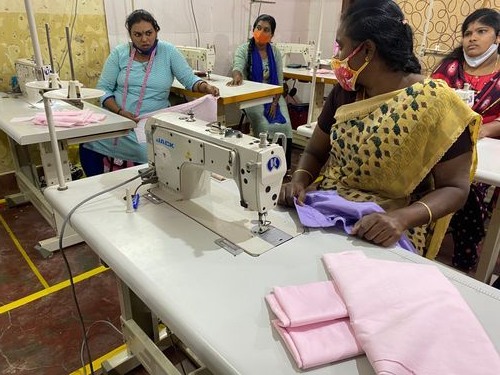
What are the coordinates of `red floor` in the screenshot? It's located at 48,329.